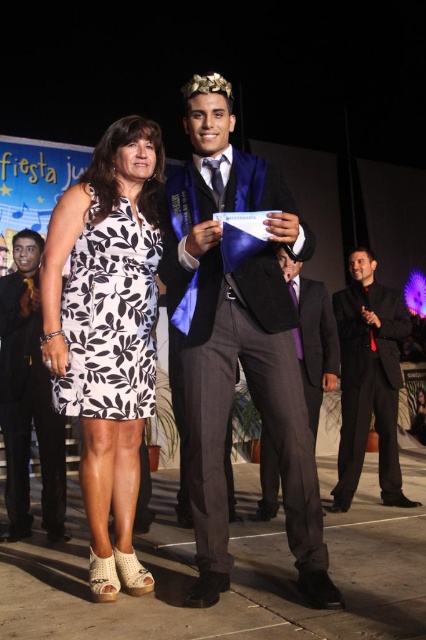
Which is more to the right, matte blue graduation gown at center or black satin suit at right?

black satin suit at right is more to the right.

Is matte blue graduation gown at center to the left of black satin suit at right from the viewer's perspective?

Yes, matte blue graduation gown at center is to the left of black satin suit at right.

Measure the distance between matte blue graduation gown at center and camera.

matte blue graduation gown at center and camera are 2.22 meters apart from each other.

Identify the location of matte blue graduation gown at center. pos(238,344).

Can you confirm if black smooth suit at center is wider than gold metallic crown at upper center?

Correct, the width of black smooth suit at center exceeds that of gold metallic crown at upper center.

This screenshot has width=426, height=640. Describe the element at coordinates (313, 337) in the screenshot. I see `black smooth suit at center` at that location.

You are a GUI agent. You are given a task and a screenshot of the screen. Output one action in this format:
    pyautogui.click(x=<x>, y=<y>)
    Task: Click on the black smooth suit at center
    This screenshot has height=640, width=426.
    Given the screenshot: What is the action you would take?
    pyautogui.click(x=313, y=337)

Where is `matte blue graduation gown at center`? matte blue graduation gown at center is located at coordinates (238, 344).

Is matte blue graduation gown at center above gold metallic crown at upper center?

No.

Find the location of a particular element. The image size is (426, 640). matte blue graduation gown at center is located at coordinates (238, 344).